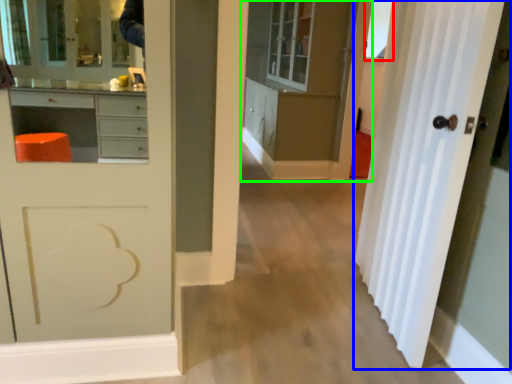
Question: Considering the real-world distances, which object is farthest from window (highlighted by a red box)? door (highlighted by a blue box) or cabinetry (highlighted by a green box)?

Choices:
 (A) door
 (B) cabinetry

Answer: (A)